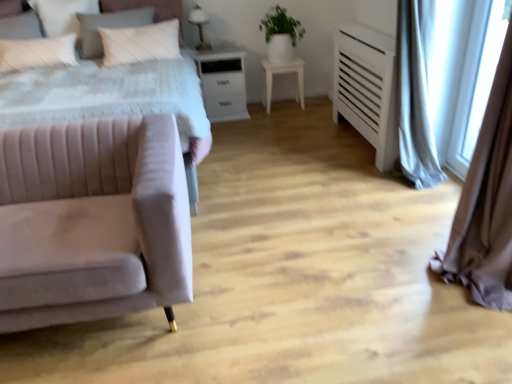
The image size is (512, 384). Find the location of `vacant area that is in front of light gray fabric curtain at right`. vacant area that is in front of light gray fabric curtain at right is located at coordinates (425, 243).